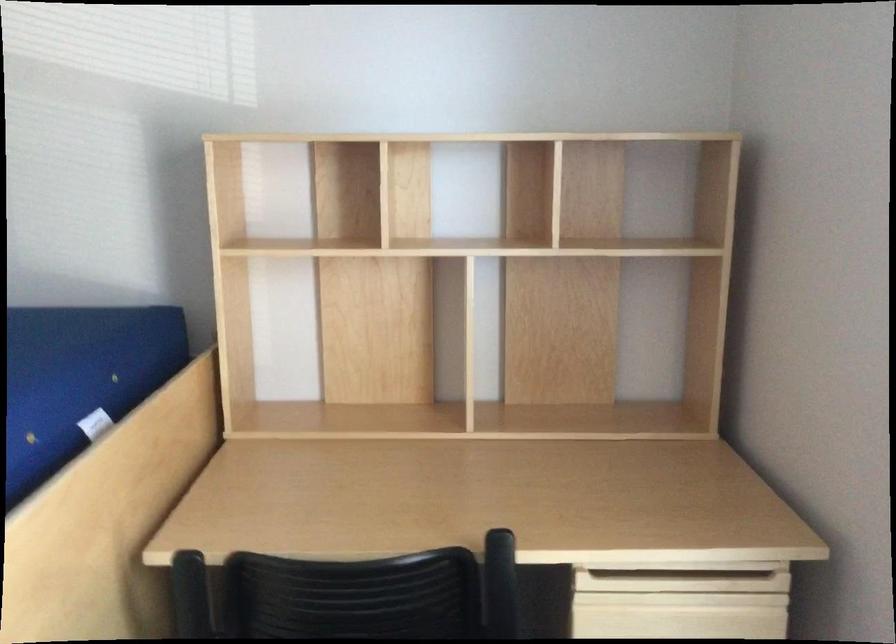
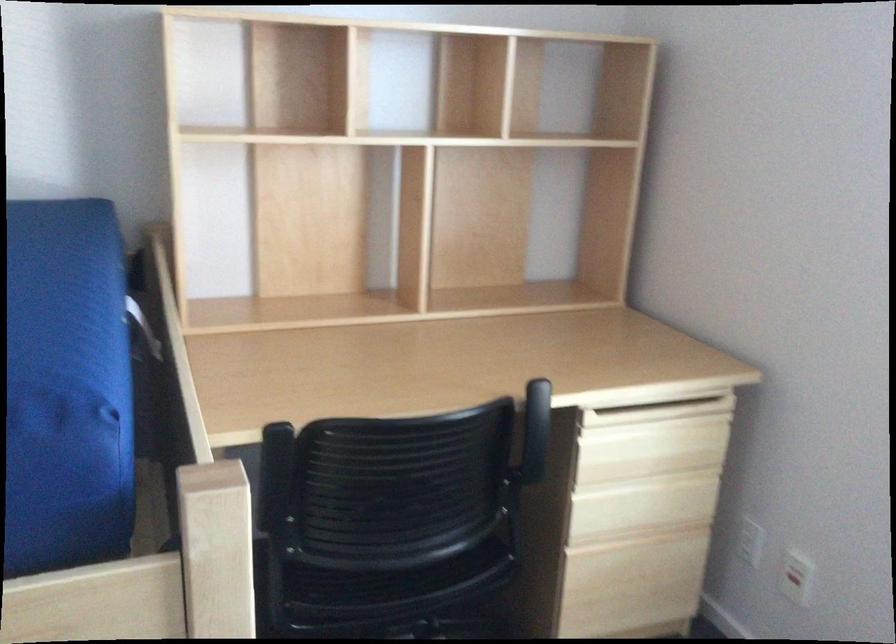
Question: Which direction would the cameraman need to move to produce the second image? Reply with the corresponding letter.

Choices:
 (A) Left
 (B) Right
 (C) Forward
 (D) Backward

Answer: (A)